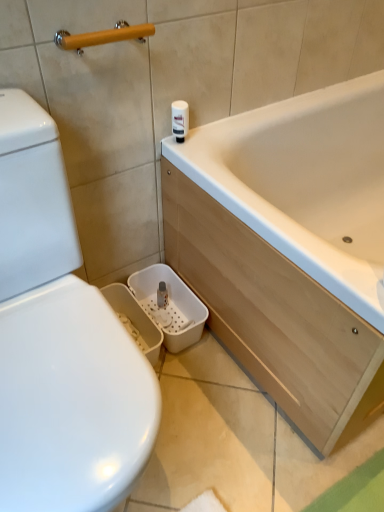
Question: From a real-world perspective, is wooden handle at upper left physically located above or below white glossy toilet paper at upper center?

Choices:
 (A) above
 (B) below

Answer: (A)

Question: Is wooden handle at upper left taller or shorter than white glossy toilet paper at upper center?

Choices:
 (A) tall
 (B) short

Answer: (B)

Question: In the image, is wooden handle at upper left positioned in front of or behind white glossy toilet paper at upper center?

Choices:
 (A) front
 (B) behind

Answer: (A)

Question: Would you say white glossy toilet paper at upper center is to the left or to the right of wooden handle at upper left in the picture?

Choices:
 (A) right
 (B) left

Answer: (A)

Question: Is white glossy toilet paper at upper center inside or outside of wooden handle at upper left?

Choices:
 (A) outside
 (B) inside

Answer: (A)

Question: Is white glossy toilet paper at upper center in front of or behind wooden handle at upper left in the image?

Choices:
 (A) front
 (B) behind

Answer: (B)

Question: From the image's perspective, is white glossy toilet paper at upper center located above or below wooden handle at upper left?

Choices:
 (A) below
 (B) above

Answer: (A)